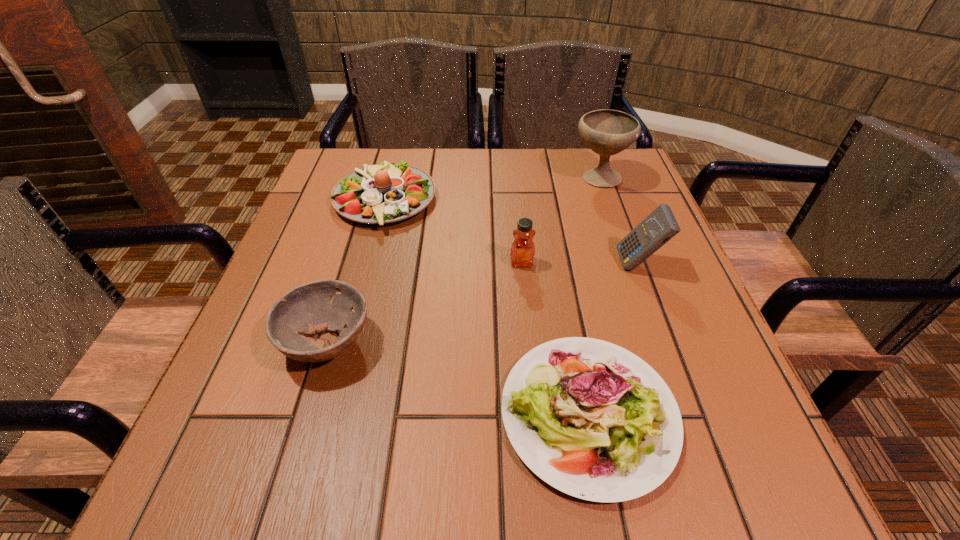
Where is `free space at the right edge of the desktop`? The width and height of the screenshot is (960, 540). free space at the right edge of the desktop is located at coordinates (650, 361).

In the image, there is a desktop. Identify the location of vacant space at the far left corner. (373, 158).

In the image, there is a desktop. At what (x,y) coordinates should I click in order to perform the action: click on vacant space at the far right corner. Please return your answer as a coordinate pair (x, y). The width and height of the screenshot is (960, 540). Looking at the image, I should click on (636, 188).

Locate an element on the screen. This screenshot has width=960, height=540. free space that is in between the taller salad plate and the shorter salad plate is located at coordinates (487, 307).

Where is `blank region between the bowl and the fourth shortest object`? The height and width of the screenshot is (540, 960). blank region between the bowl and the fourth shortest object is located at coordinates (424, 303).

I want to click on free space between the honey and the chalice, so pos(560,220).

The width and height of the screenshot is (960, 540). What are the coordinates of `free space between the chalice and the left salad plate` in the screenshot? It's located at pyautogui.click(x=492, y=190).

This screenshot has width=960, height=540. What are the coordinates of `free space that is in between the bowl and the calculator` in the screenshot? It's located at (483, 303).

Where is `free point between the calculator and the chalice`? free point between the calculator and the chalice is located at coordinates (618, 221).

Image resolution: width=960 pixels, height=540 pixels. Identify the location of free space that is in between the bowl and the nearer salad plate. (458, 378).